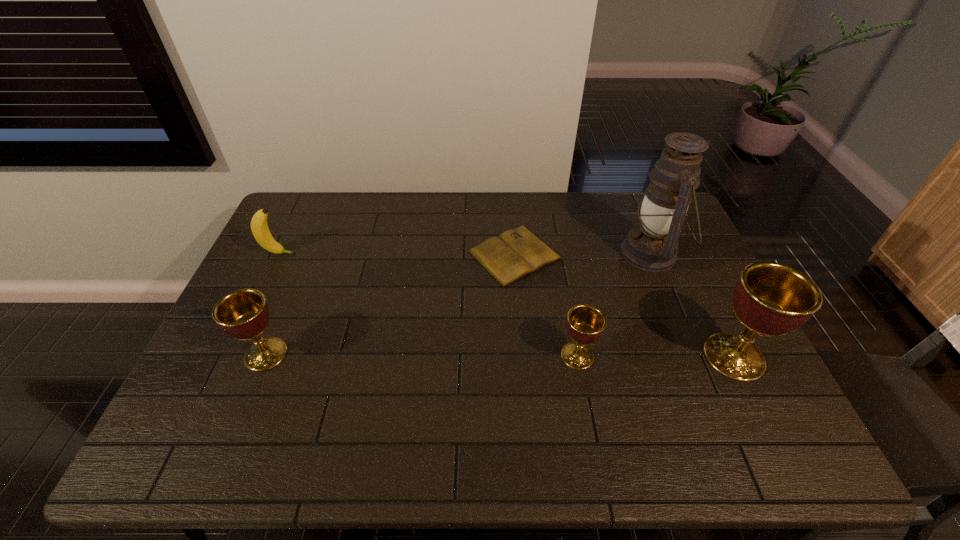
The width and height of the screenshot is (960, 540). Find the location of `the second tallest chalice`. the second tallest chalice is located at coordinates (243, 314).

Where is `the second chalice from right to left`? the second chalice from right to left is located at coordinates (585, 323).

The image size is (960, 540). Find the location of `the second shortest object`. the second shortest object is located at coordinates (585, 323).

I want to click on the tallest chalice, so click(770, 299).

I want to click on the fifth shortest object, so click(x=770, y=299).

At what (x,y) coordinates should I click in order to perform the action: click on the tallest object. Please return your answer as a coordinate pair (x, y). Looking at the image, I should click on (652, 246).

You are a GUI agent. You are given a task and a screenshot of the screen. Output one action in this format:
    pyautogui.click(x=<x>, y=<y>)
    Task: Click on the shortest object
    
    Given the screenshot: What is the action you would take?
    pyautogui.click(x=515, y=253)

What are the coordinates of `banana` in the screenshot? It's located at (259, 227).

Where is `free spot located 0.380m on the back of the second shortest chalice`? The image size is (960, 540). free spot located 0.380m on the back of the second shortest chalice is located at coordinates (311, 244).

Where is `free spot located on the left of the second chalice from left to right`? free spot located on the left of the second chalice from left to right is located at coordinates (474, 356).